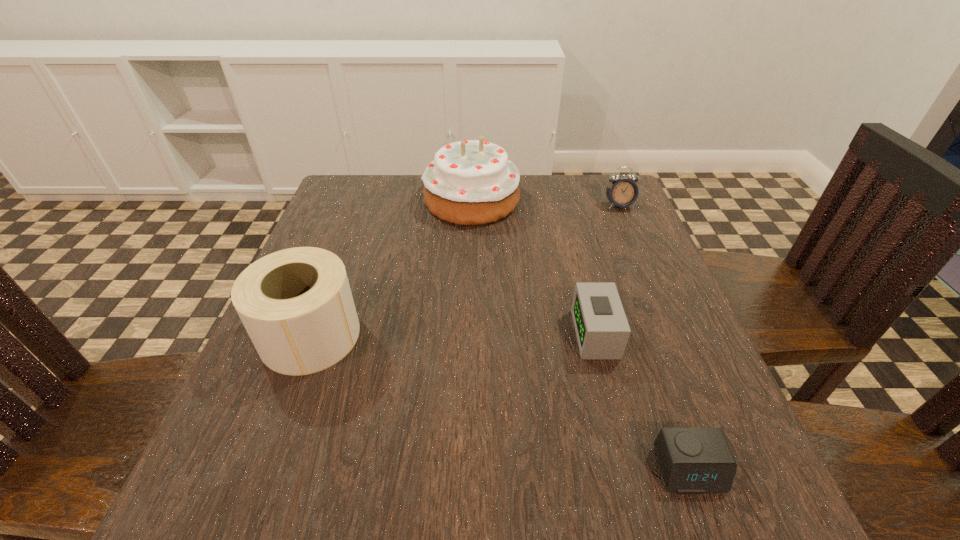
At what (x,y) coordinates should I click in order to perform the action: click on object that is at the far right corner. Please return your answer as a coordinate pair (x, y). The height and width of the screenshot is (540, 960). Looking at the image, I should click on (623, 192).

Locate an element on the screen. object that is at the near right corner is located at coordinates (693, 460).

Image resolution: width=960 pixels, height=540 pixels. Find the location of `vacant space at the far edge of the desktop`. vacant space at the far edge of the desktop is located at coordinates (409, 208).

Find the location of a particular element. vacant area at the near edge is located at coordinates (400, 474).

You are a GUI agent. You are given a task and a screenshot of the screen. Output one action in this format:
    pyautogui.click(x=<x>, y=<y>)
    Task: Click on the vacant space at the left edge
    This screenshot has height=540, width=960.
    Given the screenshot: What is the action you would take?
    pyautogui.click(x=299, y=415)

Identify the location of vacant space at the right edge of the desktop. (661, 330).

Find the location of a particular element. vacant space at the far left corner of the desktop is located at coordinates (348, 219).

Locate an element on the screen. Image resolution: width=960 pixels, height=540 pixels. vacant space at the far right corner is located at coordinates (642, 224).

At what (x,y) coordinates should I click in order to perform the action: click on free point between the nearest object and the tallest alarm clock. Please return your answer as a coordinate pair (x, y). Looking at the image, I should click on (654, 338).

Identify the location of vacant area between the nearest object and the leftmost alarm clock. (642, 402).